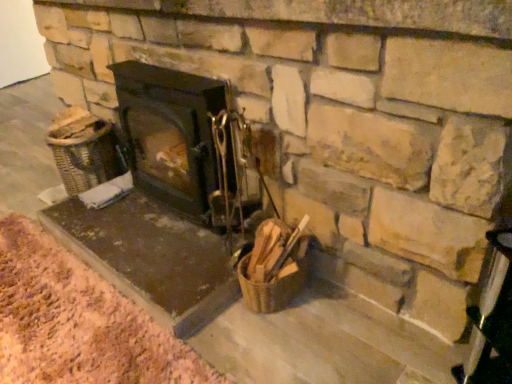
Question: Can you see matte black wood burning stove at center touching brown textured mat at lower left?

Choices:
 (A) yes
 (B) no

Answer: (B)

Question: Could brown textured mat at lower left be considered to be inside matte black wood burning stove at center?

Choices:
 (A) no
 (B) yes

Answer: (A)

Question: Can you confirm if matte black wood burning stove at center is taller than brown textured mat at lower left?

Choices:
 (A) no
 (B) yes

Answer: (B)

Question: From the image's perspective, is matte black wood burning stove at center beneath brown textured mat at lower left?

Choices:
 (A) yes
 (B) no

Answer: (B)

Question: Is matte black wood burning stove at center shorter than brown textured mat at lower left?

Choices:
 (A) yes
 (B) no

Answer: (B)

Question: Is matte black wood burning stove at center closer to camera compared to brown textured mat at lower left?

Choices:
 (A) no
 (B) yes

Answer: (A)

Question: Is brown textured mat at lower left facing away from matte black wood burning stove at center?

Choices:
 (A) yes
 (B) no

Answer: (B)

Question: Is brown textured mat at lower left outside matte black wood burning stove at center?

Choices:
 (A) no
 (B) yes

Answer: (B)

Question: Is brown textured mat at lower left far away from matte black wood burning stove at center?

Choices:
 (A) yes
 (B) no

Answer: (B)

Question: Considering the relative sizes of brown textured mat at lower left and matte black wood burning stove at center in the image provided, is brown textured mat at lower left shorter than matte black wood burning stove at center?

Choices:
 (A) no
 (B) yes

Answer: (B)

Question: From the image's perspective, is brown textured mat at lower left above matte black wood burning stove at center?

Choices:
 (A) yes
 (B) no

Answer: (B)

Question: Is brown textured mat at lower left facing towards matte black wood burning stove at center?

Choices:
 (A) yes
 (B) no

Answer: (B)

Question: In terms of size, does matte black wood burning stove at center appear bigger or smaller than brown textured mat at lower left?

Choices:
 (A) big
 (B) small

Answer: (A)